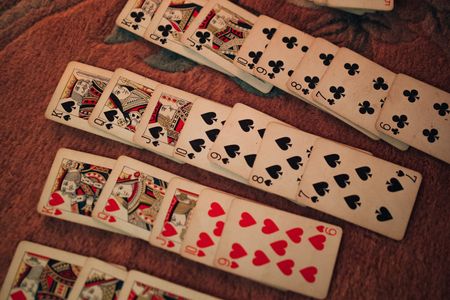
This screenshot has height=300, width=450. I want to click on rug, so click(x=73, y=48), click(x=400, y=264).